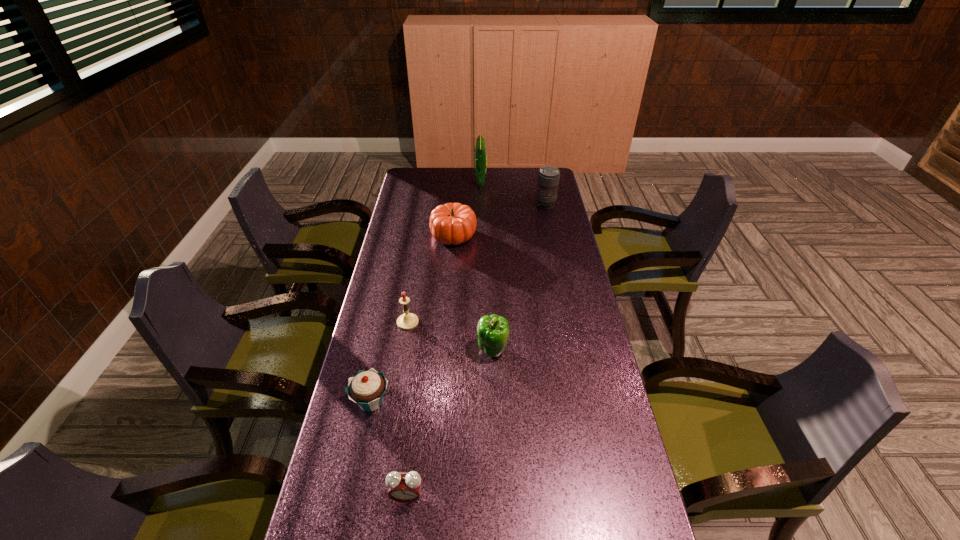
Locate an element on the screen. This screenshot has height=540, width=960. cupcake that is at the left edge is located at coordinates (367, 388).

The width and height of the screenshot is (960, 540). What are the coordinates of `object present at the right edge` in the screenshot? It's located at (548, 177).

I want to click on vacant region at the far edge of the desktop, so click(x=519, y=173).

Identify the location of vacant space at the left edge. The image size is (960, 540). (429, 194).

Identify the location of free space at the right edge of the desktop. (540, 219).

In the image, there is a desktop. Where is `vacant space at the far left corner`? The width and height of the screenshot is (960, 540). vacant space at the far left corner is located at coordinates (420, 179).

Find the location of a particular element. This screenshot has width=960, height=540. free point between the cupcake and the nearest object is located at coordinates (389, 449).

Find the location of a particular element. vacant area between the cupcake and the rightmost object is located at coordinates (459, 303).

Identify the location of empty location between the alarm clock and the farthest object. tap(444, 339).

Locate an element on the screen. Image resolution: width=960 pixels, height=540 pixels. vacant area that lies between the pumpkin and the second farthest object is located at coordinates (499, 220).